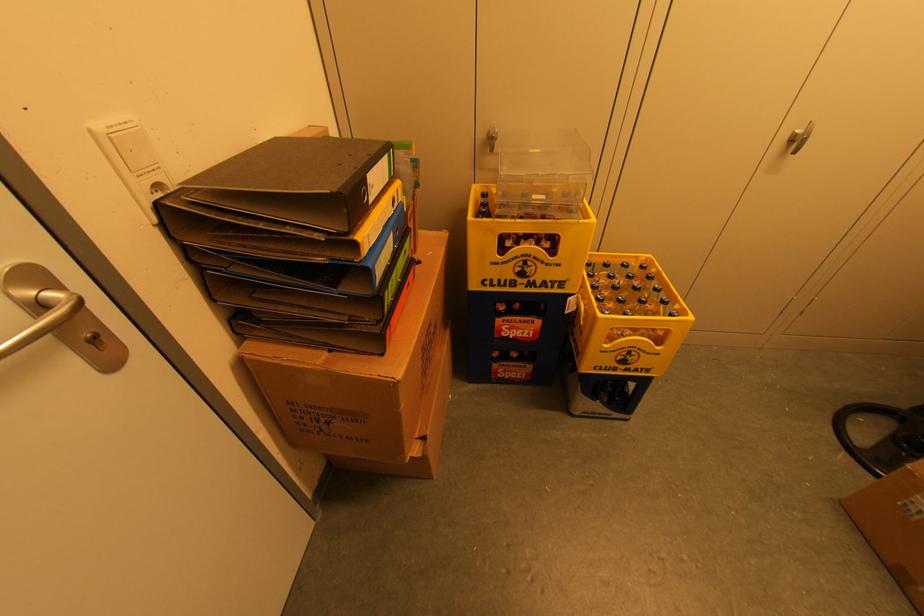
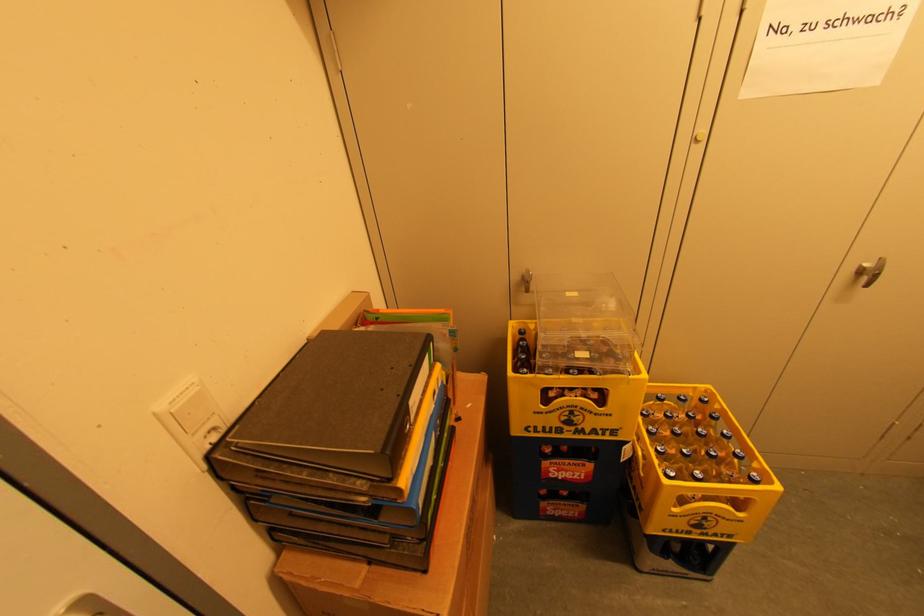
Find the pixel in the second image that matches point (798, 142) in the first image.

(869, 275)